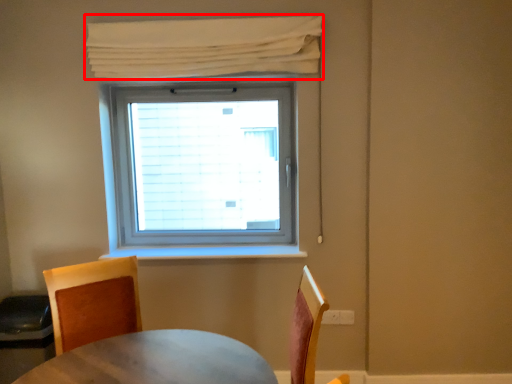
Question: Where is curtain (annotated by the red box) located in relation to chair in the image?

Choices:
 (A) left
 (B) right

Answer: (B)